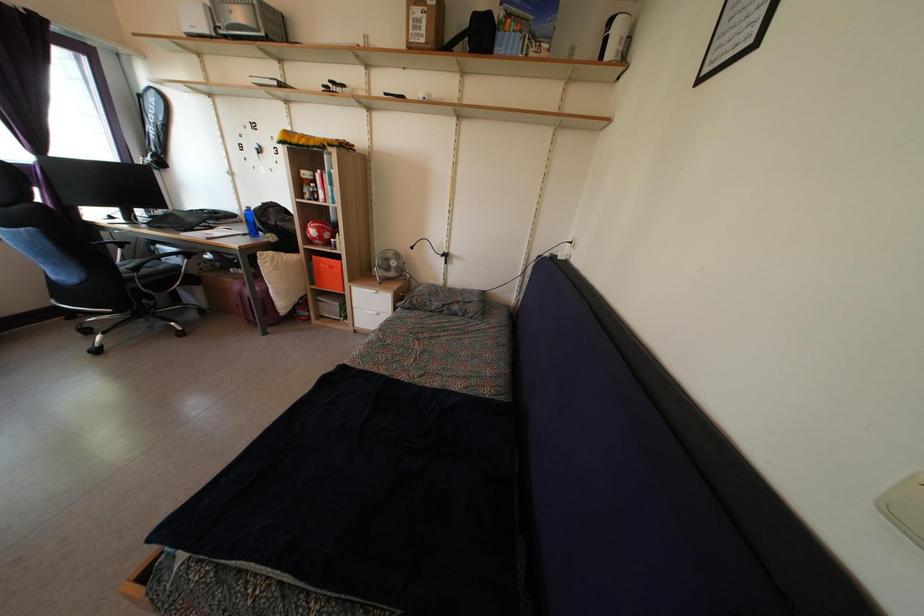
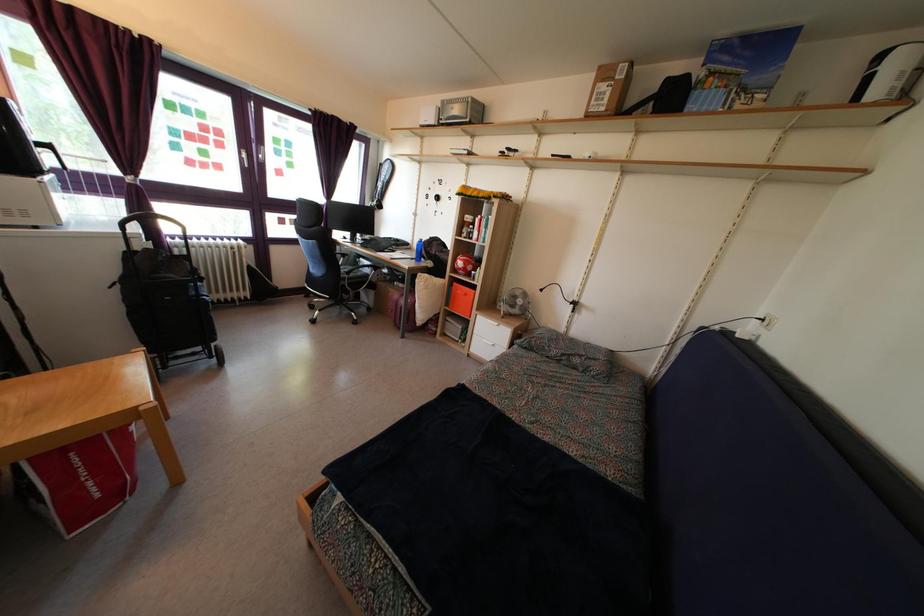
Find the pixel in the second image that matches (x=139, y=278) in the first image.

(350, 282)